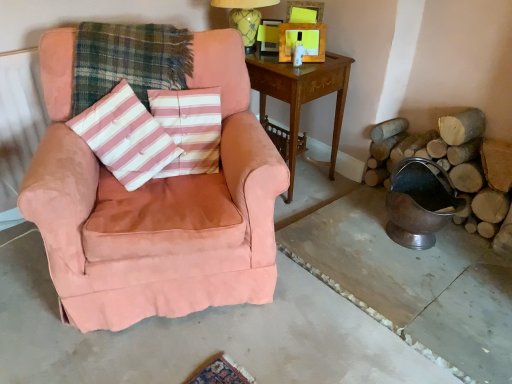
I want to click on vacant area that is in front of polished silver swivel chair at lower right, so click(x=437, y=286).